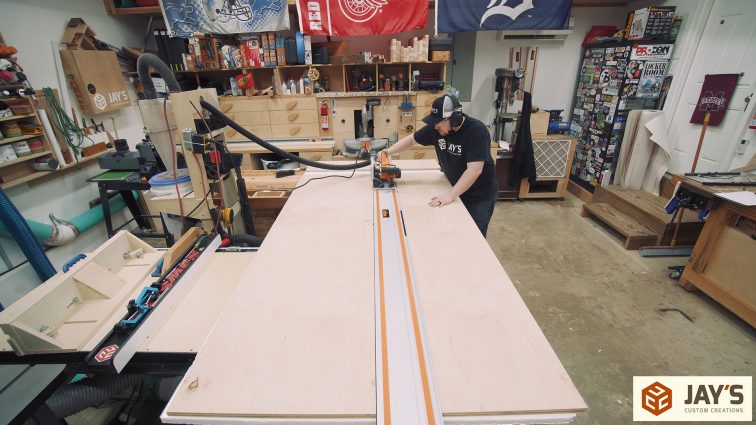
The image size is (756, 425). I want to click on drawers, so click(240, 104), click(248, 119), click(256, 134), click(282, 105), click(286, 116), click(295, 133), click(420, 100), click(420, 112), click(417, 125).